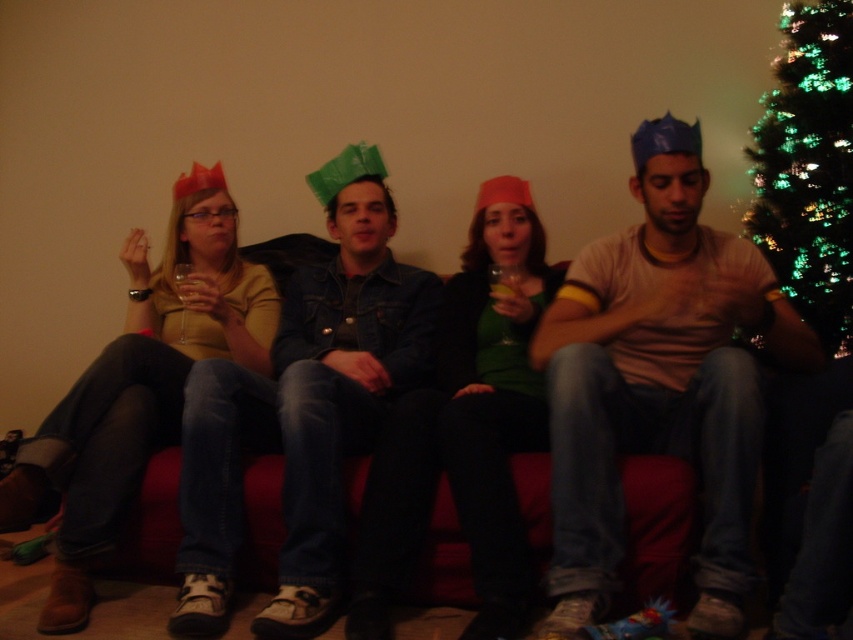
Question: Is matte brown shirt at center to the left of green glittering lights at upper right from the viewer's perspective?

Choices:
 (A) yes
 (B) no

Answer: (A)

Question: Among these objects, which one is farthest from the camera?

Choices:
 (A) matte brown shirt at center
 (B) denim jacket at center
 (C) green glittering lights at upper right

Answer: (C)

Question: Is matte brown shirt at center above green glittering lights at upper right?

Choices:
 (A) no
 (B) yes

Answer: (A)

Question: Can you confirm if matte brown shirt at center is wider than denim jacket at center?

Choices:
 (A) yes
 (B) no

Answer: (A)

Question: Which is farther from the denim jacket at center?

Choices:
 (A) matte brown shirt at center
 (B) green glittering lights at upper right

Answer: (B)

Question: Which object is closer to the camera taking this photo?

Choices:
 (A) green glittering lights at upper right
 (B) denim jacket at center

Answer: (B)